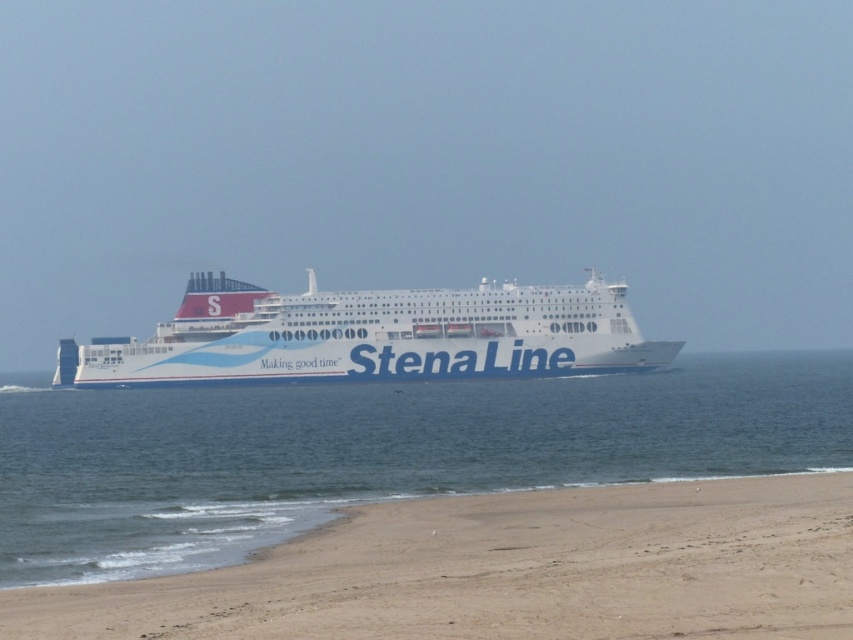
You are a photographer trying to capture the white water at center and the white glossy cruise ship at center in a single shot. Given that your camera can only focus on objects within a 100 meter range, can you confirm if both objects are within the camera range?

The white water at center has a smaller size compared to the white glossy cruise ship at center, but this does not indicate their distance from the camera. Without specific distance information, it is impossible to determine if both are within the 100 meter range.